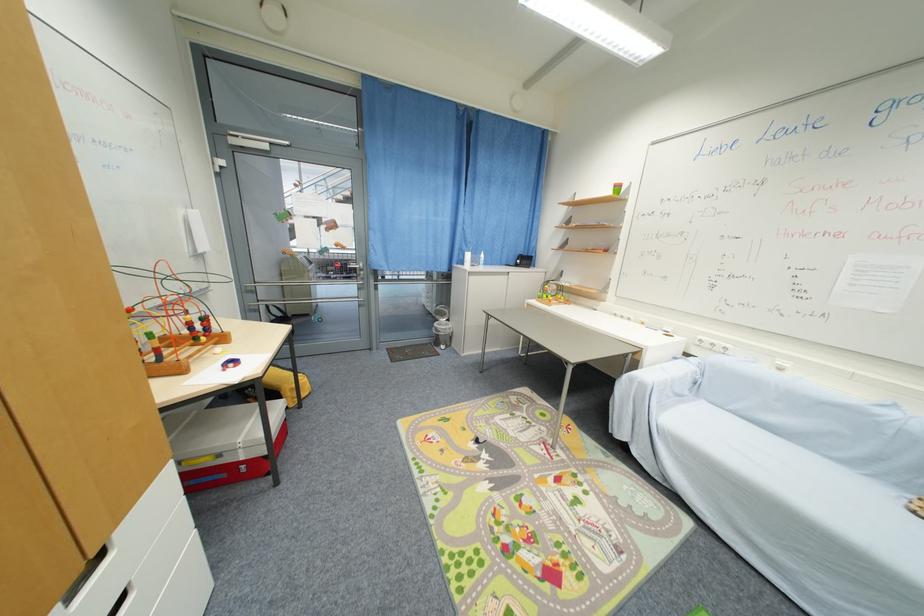
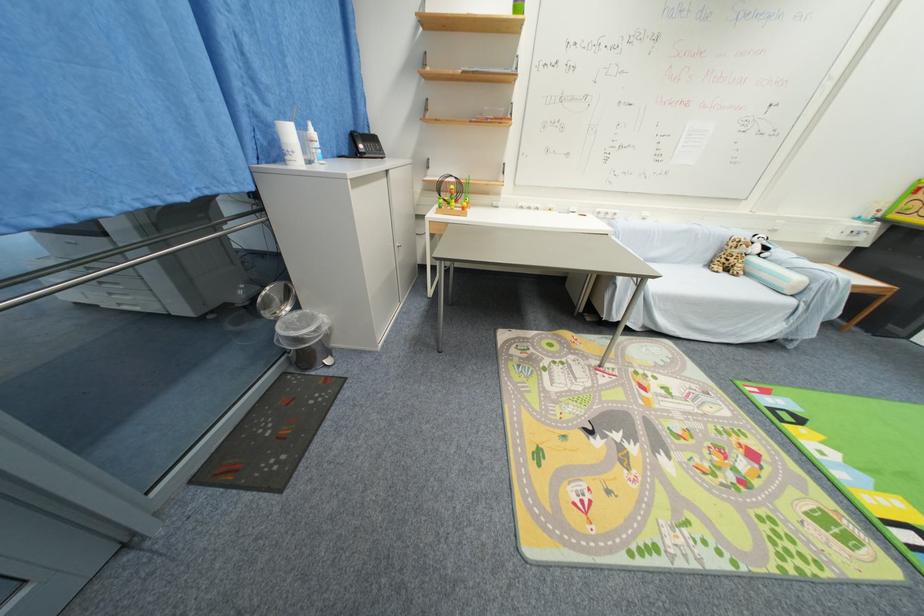
Question: I am providing you with two images of the same scene from different viewpoints. Please identify which objects are invisible in image2.

Choices:
 (A) toy bead
 (B) sofa armrest
 (C) panda stuffed animal
 (D) none of these

Answer: (D)